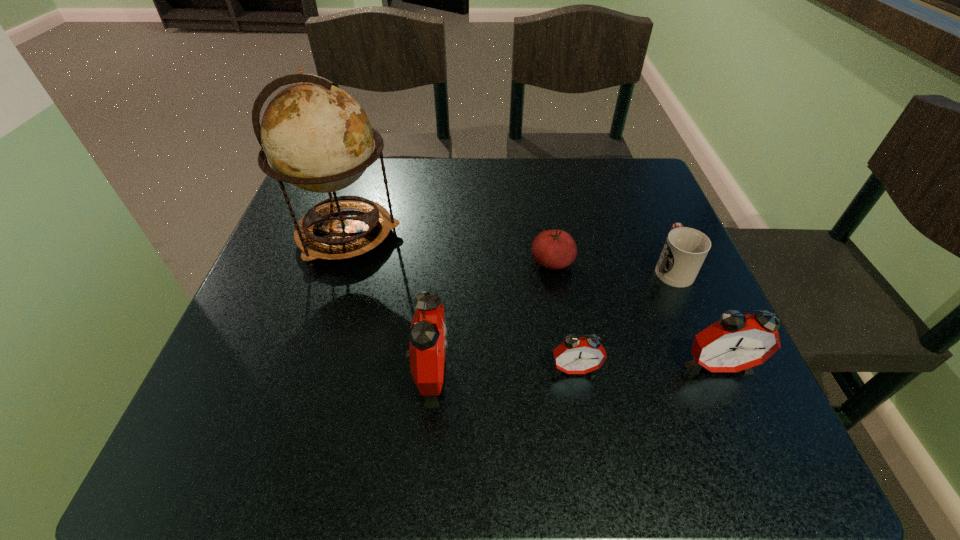
I want to click on the second object from left to right, so click(428, 336).

The height and width of the screenshot is (540, 960). What are the coordinates of `the second alarm clock from left to right` in the screenshot? It's located at (575, 355).

You are a GUI agent. You are given a task and a screenshot of the screen. Output one action in this format:
    pyautogui.click(x=<x>, y=<y>)
    Task: Click on the rightmost alarm clock
    This screenshot has height=540, width=960.
    Given the screenshot: What is the action you would take?
    pyautogui.click(x=736, y=342)

Where is `the fourth shortest object`? The height and width of the screenshot is (540, 960). the fourth shortest object is located at coordinates (736, 342).

Locate an element on the screen. This screenshot has width=960, height=540. the tallest object is located at coordinates (317, 137).

Image resolution: width=960 pixels, height=540 pixels. I want to click on the leftmost object, so click(x=317, y=137).

Locate an element on the screen. tomato is located at coordinates (553, 249).

Locate an element on the screen. This screenshot has width=960, height=540. cup is located at coordinates (685, 249).

At what (x,y) coordinates should I click in order to perform the action: click on free space located 0.120m on the clock face of the second object from left to right. Please return your answer as a coordinate pair (x, y). Looking at the image, I should click on (520, 373).

The width and height of the screenshot is (960, 540). Identify the location of blank area located 0.330m at the center of the tallest object. (548, 235).